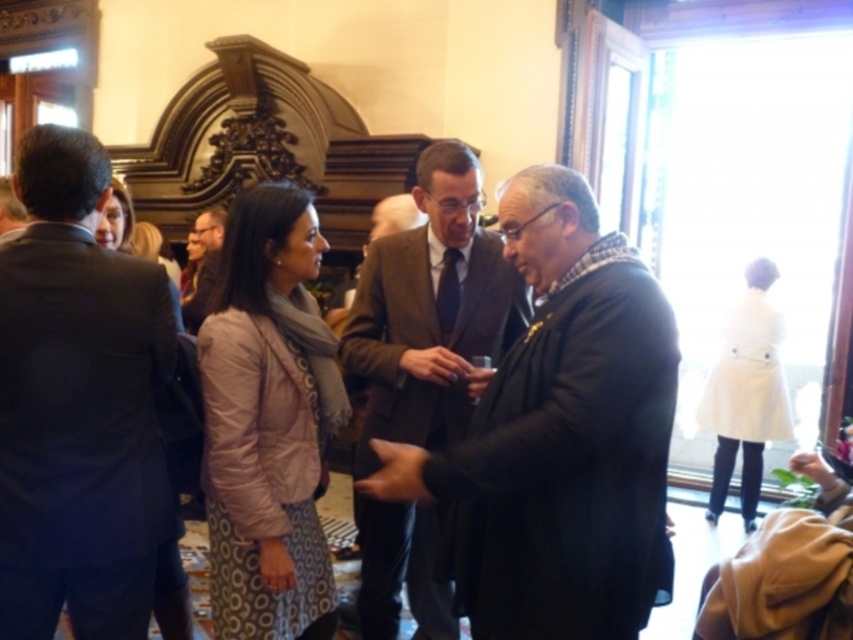
Question: Which object is positioned farthest from the brown wool suit at center?

Choices:
 (A) white wool coat at right
 (B) dark blue suit at left
 (C) matte brown suit at center
 (D) pale pink quilted jacket at center

Answer: (A)

Question: Is brown wool suit at center positioned before matte brown suit at center?

Choices:
 (A) yes
 (B) no

Answer: (A)

Question: Is pale pink quilted jacket at center above matte brown suit at center?

Choices:
 (A) no
 (B) yes

Answer: (A)

Question: Which point is closer to the camera?

Choices:
 (A) (51, 381)
 (B) (305, 452)
 (C) (189, 323)
 (D) (770, 275)

Answer: (A)

Question: Which point is closer to the camera?

Choices:
 (A) pale pink quilted jacket at center
 (B) dark blue suit at left

Answer: (B)

Question: Is pale pink quilted jacket at center bigger than brown wool suit at center?

Choices:
 (A) yes
 (B) no

Answer: (B)